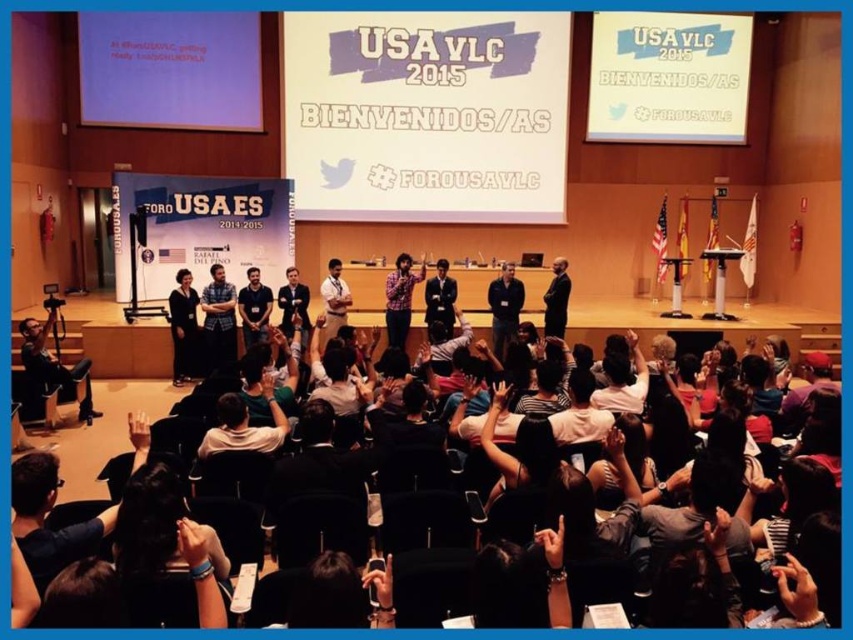
Question: From the image, what is the correct spatial relationship of white paperboard at center in relation to dark blue shirt at center?

Choices:
 (A) below
 (B) above

Answer: (B)

Question: Which object is closer to the camera taking this photo?

Choices:
 (A) dark gray fabric dress at center
 (B) dark blue suit at center
 (C) white text on screen at upper left
 (D) matte black shirt at center

Answer: (A)

Question: Is matte blue shirt at center thinner than dark blue shirt at center?

Choices:
 (A) yes
 (B) no

Answer: (B)

Question: Considering the real-world distances, which object is closest to the white text on screen at upper left?

Choices:
 (A) matte black shirt at center
 (B) dark blue suit at center

Answer: (A)

Question: Observing the image, what is the correct spatial positioning of dark blue shirt at center in reference to dark blue suit at center?

Choices:
 (A) left
 (B) right

Answer: (B)

Question: Which of the following is the farthest from the observer?

Choices:
 (A) dark gray suit at center
 (B) dark gray fabric dress at center
 (C) dark blue shirt at center
 (D) dark blue suit at center

Answer: (C)